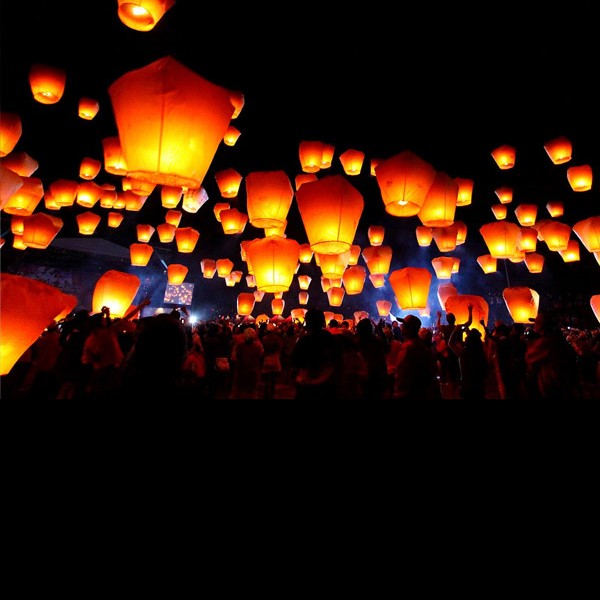
Image resolution: width=600 pixels, height=600 pixels. I want to click on topmost lantern, so click(141, 7).